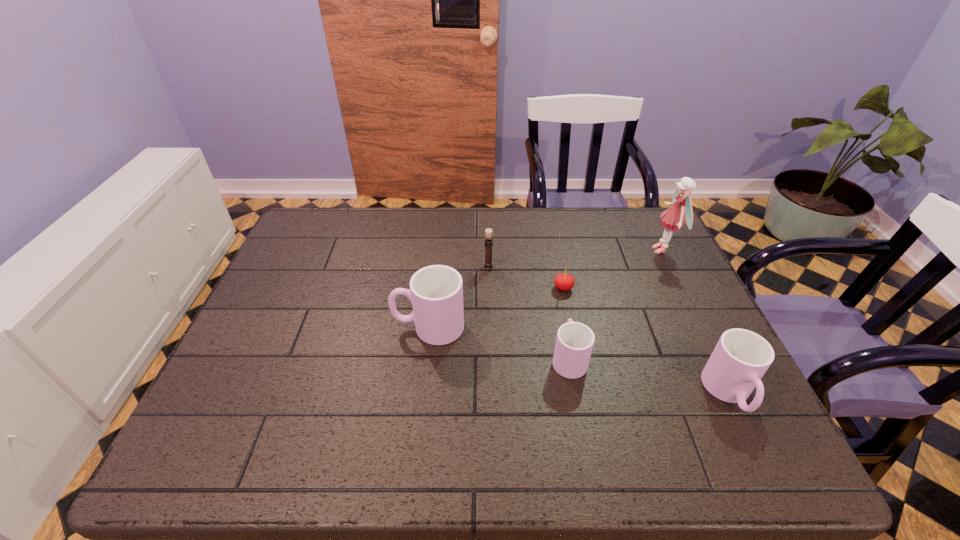
Locate an element on the screen. The height and width of the screenshot is (540, 960). the tallest cup is located at coordinates (436, 292).

Image resolution: width=960 pixels, height=540 pixels. Find the location of `the leftmost cup`. the leftmost cup is located at coordinates (436, 292).

Identify the location of the shortest cup. This screenshot has width=960, height=540. (574, 343).

Identify the location of the second tallest cup. This screenshot has width=960, height=540. (741, 357).

The image size is (960, 540). In order to click on candle holder in this screenshot , I will do `click(487, 265)`.

Where is `the tallest object`? This screenshot has height=540, width=960. the tallest object is located at coordinates (673, 218).

I want to click on cherry, so click(x=563, y=282).

This screenshot has height=540, width=960. I want to click on free space located 0.250m with the handle on the side of the leftmost cup, so click(295, 327).

The image size is (960, 540). In order to click on free space located 0.180m with the handle on the side of the leftmost cup in this screenshot , I will do `click(322, 327)`.

The height and width of the screenshot is (540, 960). Identify the location of vacant point located 0.060m with the handle on the side of the leftmost cup. (370, 327).